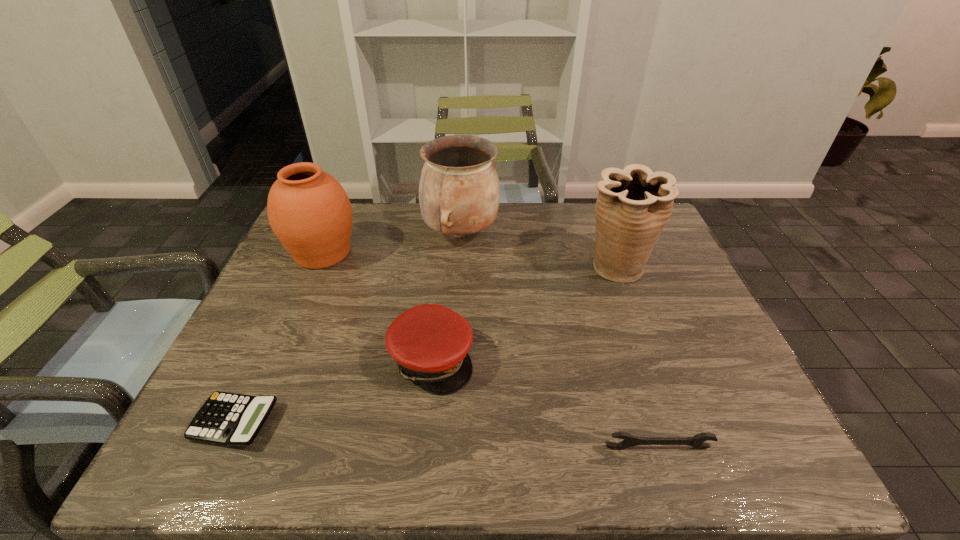
This screenshot has height=540, width=960. Identify the location of blank space at the far edge. (555, 219).

In the image, there is a desktop. Where is `vacant space at the left edge`? This screenshot has width=960, height=540. vacant space at the left edge is located at coordinates (299, 291).

Where is `free space at the right edge of the desktop`? The width and height of the screenshot is (960, 540). free space at the right edge of the desktop is located at coordinates (761, 409).

Find the location of a particular element. free space between the shortest object and the fourth tallest object is located at coordinates (333, 390).

Image resolution: width=960 pixels, height=540 pixels. In order to click on vacant area between the leftmost urn and the rightmost urn in this screenshot , I will do `click(469, 261)`.

The height and width of the screenshot is (540, 960). In order to click on free space between the rightmost urn and the leftmost urn in this screenshot , I will do `click(469, 261)`.

I want to click on vacant point located between the second urn from left to right and the rightmost urn, so click(539, 251).

This screenshot has height=540, width=960. In order to click on vacant region between the rightmost urn and the second urn from left to right in this screenshot , I will do click(539, 251).

Find the location of `free spot between the leftmost urn and the fifth tallest object`. free spot between the leftmost urn and the fifth tallest object is located at coordinates (490, 350).

Find the location of a particular element. This screenshot has width=960, height=540. vacant area that lies between the rightmost urn and the second urn from right to left is located at coordinates (539, 251).